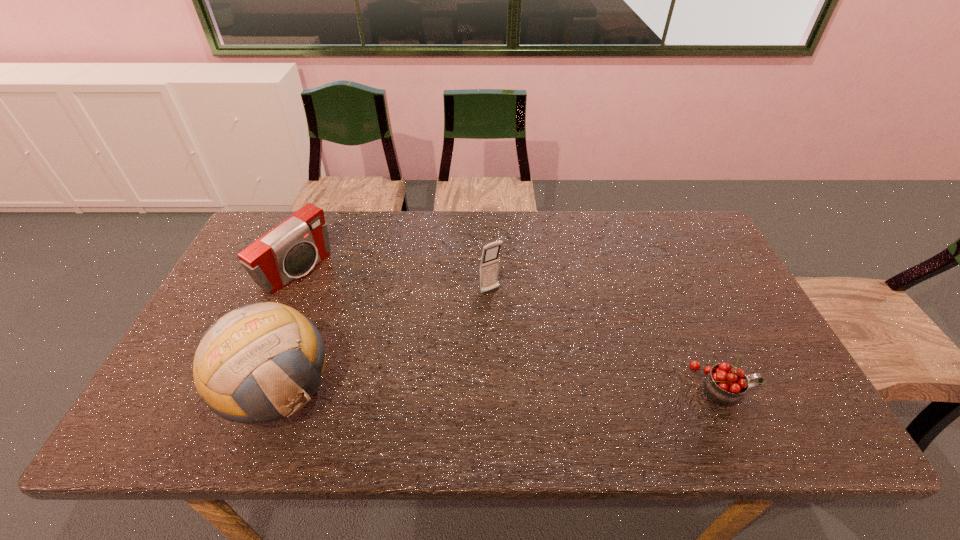
You are a GUI agent. You are given a task and a screenshot of the screen. Output one action in this format:
    pyautogui.click(x=<x>, y=<y>)
    Task: Click on the vacant space located on the front-facing side of the camera
    The image size is (960, 540).
    Given the screenshot: What is the action you would take?
    pyautogui.click(x=337, y=300)

This screenshot has height=540, width=960. Identify the location of free point located 0.350m on the front-facing side of the camera. (406, 345).

Find the location of `free location located 0.270m on the front-facing side of the camera`. free location located 0.270m on the front-facing side of the camera is located at coordinates (383, 330).

At what (x,y) coordinates should I click in order to perform the action: click on object that is positioned at the far edge. Please return your answer as a coordinate pair (x, y). Looking at the image, I should click on (290, 250).

At what (x,y) coordinates should I click in order to perform the action: click on volleyball located at the near edge. Please return your answer as a coordinate pair (x, y). The height and width of the screenshot is (540, 960). Looking at the image, I should click on (261, 362).

The width and height of the screenshot is (960, 540). What are the coordinates of `pot filled with cherries located in the near edge section of the desktop` in the screenshot? It's located at (725, 384).

At what (x,y) coordinates should I click in order to perform the action: click on volleyball at the left edge. Please return your answer as a coordinate pair (x, y). This screenshot has width=960, height=540. Looking at the image, I should click on (261, 362).

Image resolution: width=960 pixels, height=540 pixels. I want to click on camera at the left edge, so click(290, 250).

You are a GUI agent. You are given a task and a screenshot of the screen. Output one action in this format:
    pyautogui.click(x=<x>, y=<y>)
    Task: Click on the object at the right edge
    This screenshot has height=540, width=960.
    Given the screenshot: What is the action you would take?
    pyautogui.click(x=725, y=384)

Where is `object that is positioned at the far left corner`? Image resolution: width=960 pixels, height=540 pixels. object that is positioned at the far left corner is located at coordinates (290, 250).